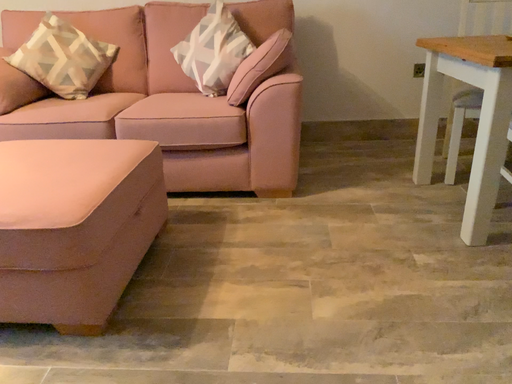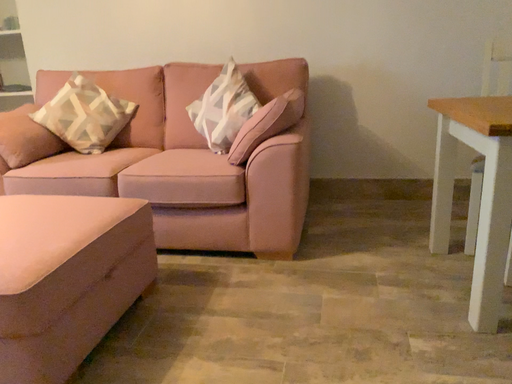
Question: How did the camera likely rotate when shooting the video?

Choices:
 (A) rotated left
 (B) rotated right

Answer: (A)